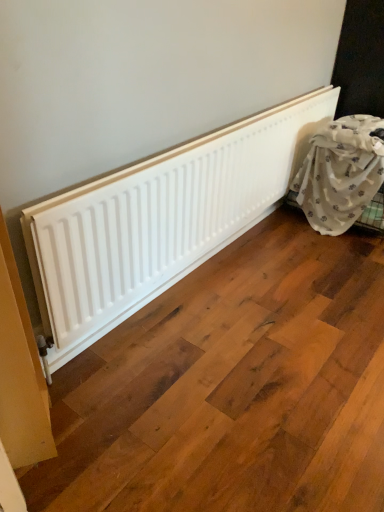
Question: From the image's perspective, relative to white fabric at right, is white matte radiator at center above or below?

Choices:
 (A) below
 (B) above

Answer: (A)

Question: Is point (160, 181) positioned closer to the camera than point (334, 184)?

Choices:
 (A) closer
 (B) farther

Answer: (A)

Question: From a real-world perspective, is white matte radiator at center above or below white fabric at right?

Choices:
 (A) below
 (B) above

Answer: (B)

Question: From the image's perspective, is white fabric at right located above or below white matte radiator at center?

Choices:
 (A) below
 (B) above

Answer: (B)

Question: Is white fabric at right spatially inside white matte radiator at center, or outside of it?

Choices:
 (A) inside
 (B) outside

Answer: (B)

Question: From a real-world perspective, is white fabric at right positioned above or below white matte radiator at center?

Choices:
 (A) above
 (B) below

Answer: (B)

Question: Is white fabric at right taller or shorter than white matte radiator at center?

Choices:
 (A) short
 (B) tall

Answer: (B)